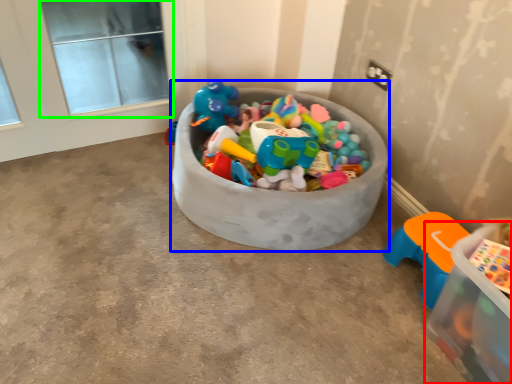
Question: Which object is positioned farthest from storage box (highlighted by a red box)? Select from storage box (highlighted by a blue box) and window screen (highlighted by a green box).

Choices:
 (A) storage box
 (B) window screen

Answer: (B)